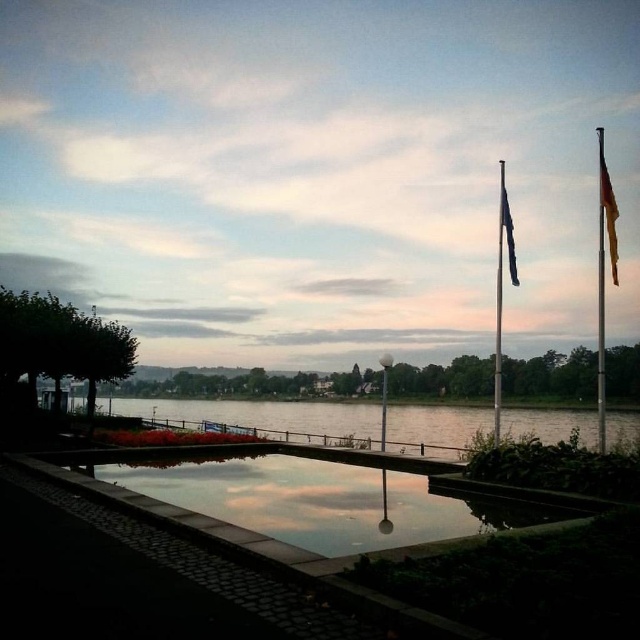
You are standing at the center of the walkway and want to place a bench so that it is exactly halfway between the metallic flag pole at right and the reflecting pool. Where should you place the bench?

The bench should be placed halfway between the metallic flag pole at right and the reflecting pool. Since the metallic flag pole at right is located at point (499,307), you can calculate the midpoint between this coordinate and the reflecting pool to determine the bench location.

You are standing on the cobblestone walkway and want to place a new flower pot between the polished metal flag pole at right and the german flag at right. Which side of the flower pot should face the pool?

The flower pot should be placed with its right side facing the pool because the polished metal flag pole at right is to the left of the german flag at right, meaning the flag pole is closer to the pool than the flag.

You are a tourist standing on the cobblestone walkway near the reflecting pool. You see the metallic flag pole at right and the blue fabric flag at upper center. Which object is located to the left of the other?

The metallic flag pole at right is positioned on the left side of blue fabric flag at upper center.